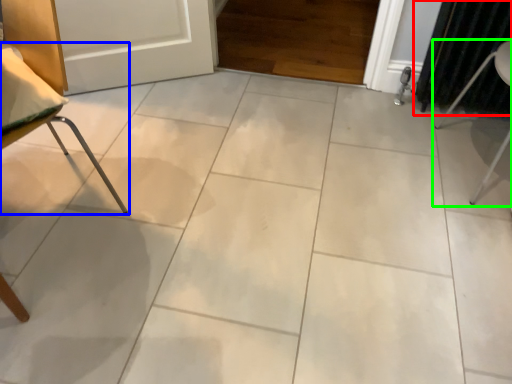
Question: Which object is positioned closest to curtain (highlighted by a red box)? Select from furniture (highlighted by a blue box) and furniture (highlighted by a green box).

Choices:
 (A) furniture
 (B) furniture

Answer: (B)